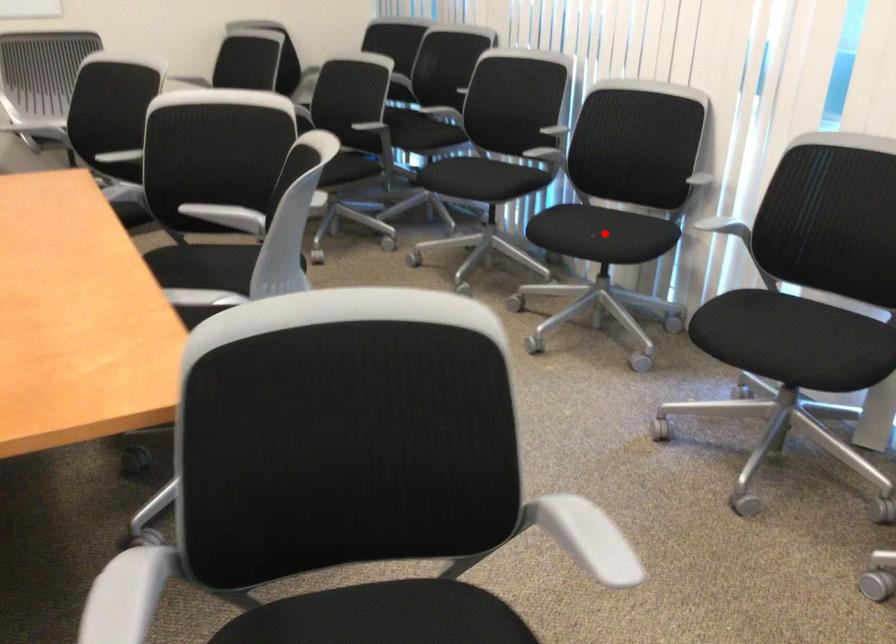
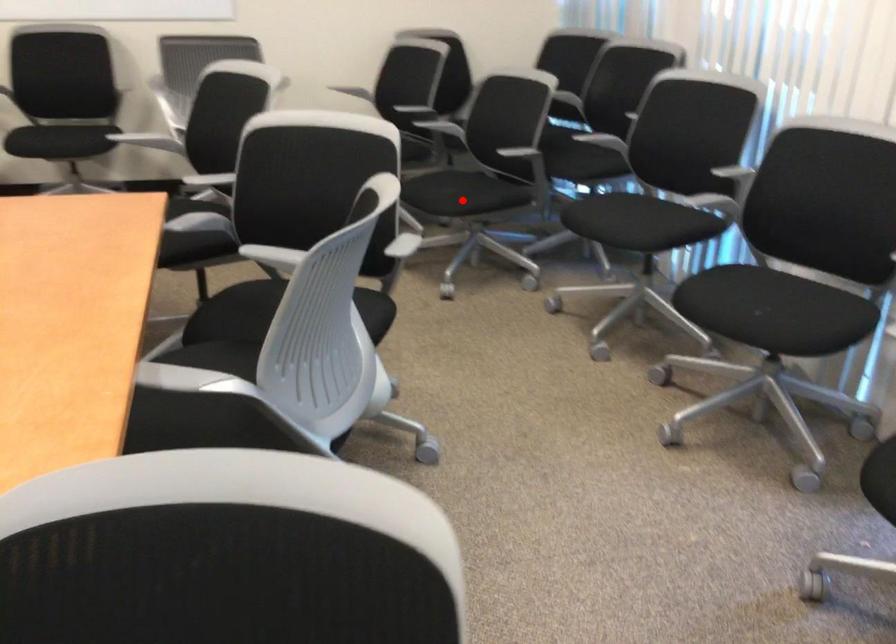
I am providing you with two images of the same scene from different viewpoints. A red point is marked on the first image and another point is marked on the second image. Is the red point in image1 aligned with the point shown in image2?

No